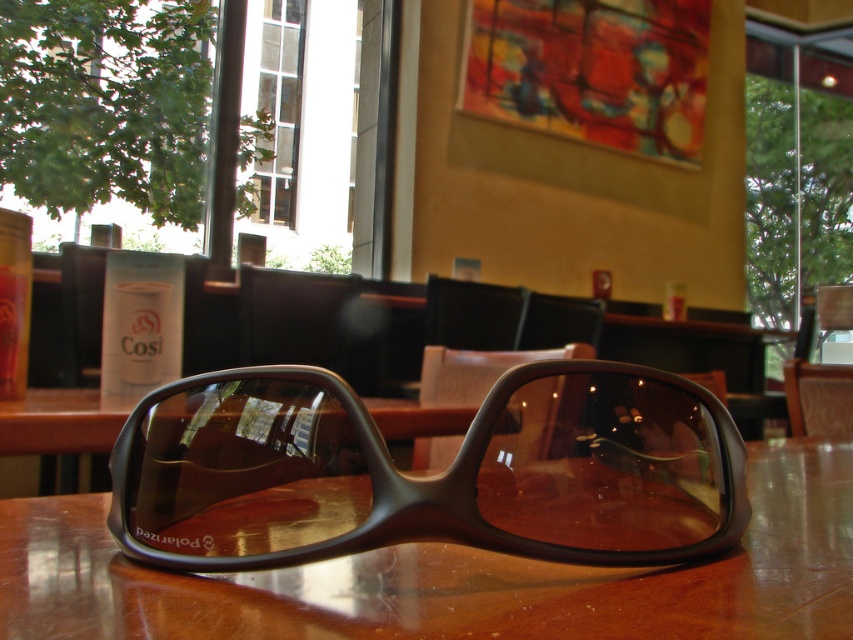
Question: Which object is farther from the camera taking this photo?

Choices:
 (A) matte black sunglasses at center
 (B) brown polished wood table at center

Answer: (A)

Question: Can you confirm if matte black sunglasses at center is positioned below brown polished wood table at center?

Choices:
 (A) no
 (B) yes

Answer: (A)

Question: In this image, where is matte black sunglasses at center located relative to brown polished wood table at center?

Choices:
 (A) below
 (B) above

Answer: (B)

Question: In this image, where is matte black sunglasses at center located relative to brown polished wood table at center?

Choices:
 (A) right
 (B) left

Answer: (B)

Question: Which object is farther from the camera taking this photo?

Choices:
 (A) brown polished wood table at center
 (B) matte black sunglasses at center

Answer: (B)